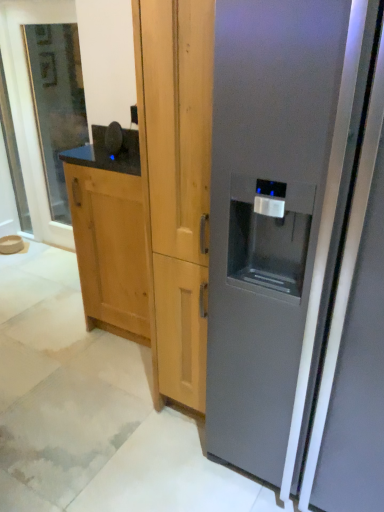
Question: Is the position of clear glass door at left more distant than that of satin gray refrigerator at right?

Choices:
 (A) no
 (B) yes

Answer: (B)

Question: Considering the relative positions of clear glass door at left and satin gray refrigerator at right in the image provided, is clear glass door at left in front of satin gray refrigerator at right?

Choices:
 (A) no
 (B) yes

Answer: (A)

Question: From the image's perspective, is clear glass door at left over satin gray refrigerator at right?

Choices:
 (A) no
 (B) yes

Answer: (B)

Question: Is clear glass door at left aimed at satin gray refrigerator at right?

Choices:
 (A) yes
 (B) no

Answer: (B)

Question: From a real-world perspective, is clear glass door at left below satin gray refrigerator at right?

Choices:
 (A) yes
 (B) no

Answer: (B)

Question: Is clear glass door at left facing away from satin gray refrigerator at right?

Choices:
 (A) yes
 (B) no

Answer: (B)

Question: Considering the relative sizes of satin gray refrigerator at right and natural wood cabinet at left in the image provided, is satin gray refrigerator at right smaller than natural wood cabinet at left?

Choices:
 (A) no
 (B) yes

Answer: (A)

Question: Is natural wood cabinet at left at the back of satin gray refrigerator at right?

Choices:
 (A) no
 (B) yes

Answer: (A)

Question: Considering the relative sizes of satin gray refrigerator at right and natural wood cabinet at left in the image provided, is satin gray refrigerator at right shorter than natural wood cabinet at left?

Choices:
 (A) yes
 (B) no

Answer: (B)

Question: Can you confirm if satin gray refrigerator at right is wider than natural wood cabinet at left?

Choices:
 (A) yes
 (B) no

Answer: (A)

Question: Does satin gray refrigerator at right appear on the right side of natural wood cabinet at left?

Choices:
 (A) no
 (B) yes

Answer: (B)

Question: From the image's perspective, is satin gray refrigerator at right on top of natural wood cabinet at left?

Choices:
 (A) yes
 (B) no

Answer: (B)

Question: Does natural wood cabinet at left have a larger size compared to clear glass door at left?

Choices:
 (A) yes
 (B) no

Answer: (A)